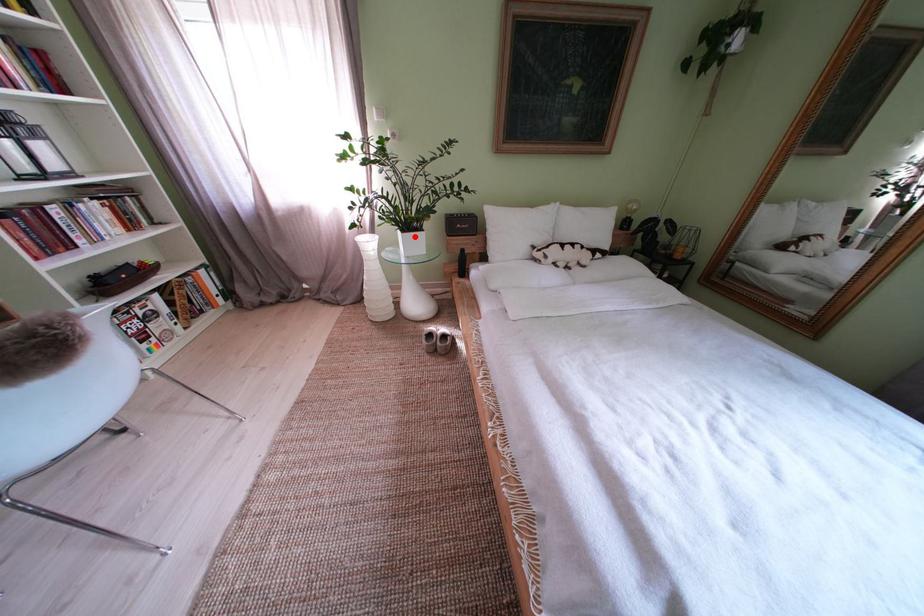
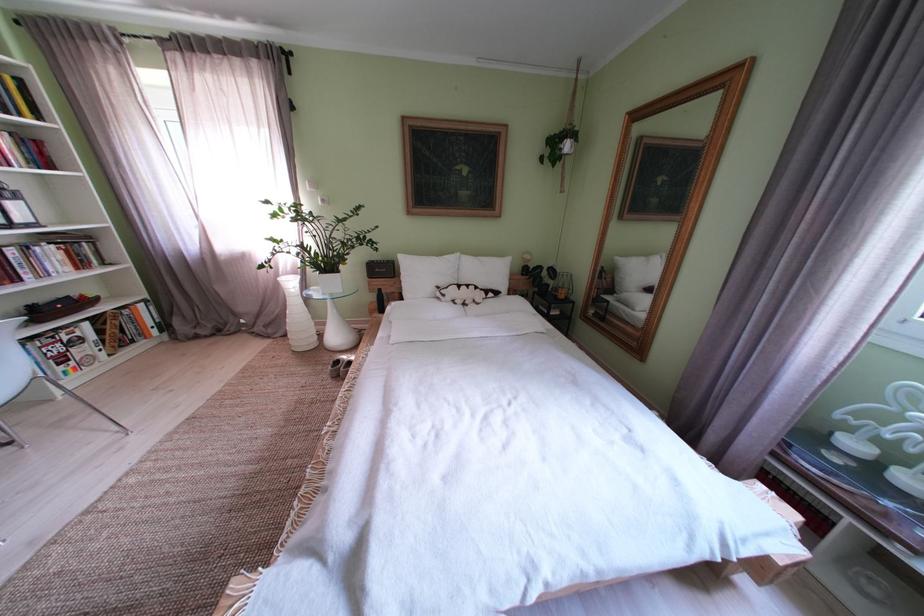
Find the pixel in the second image that matches the highlighted location in the first image.

(333, 278)